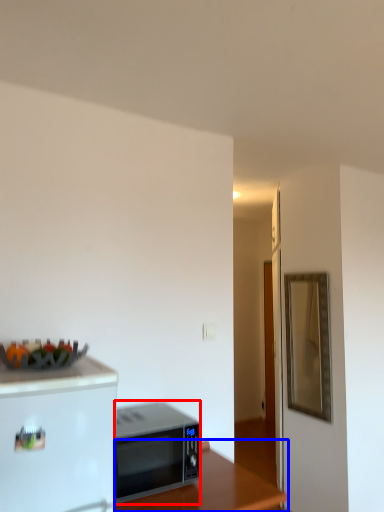
Question: Which object appears farthest to the camera in this image, microwave oven (highlighted by a red box) or table (highlighted by a blue box)?

Choices:
 (A) microwave oven
 (B) table

Answer: (A)